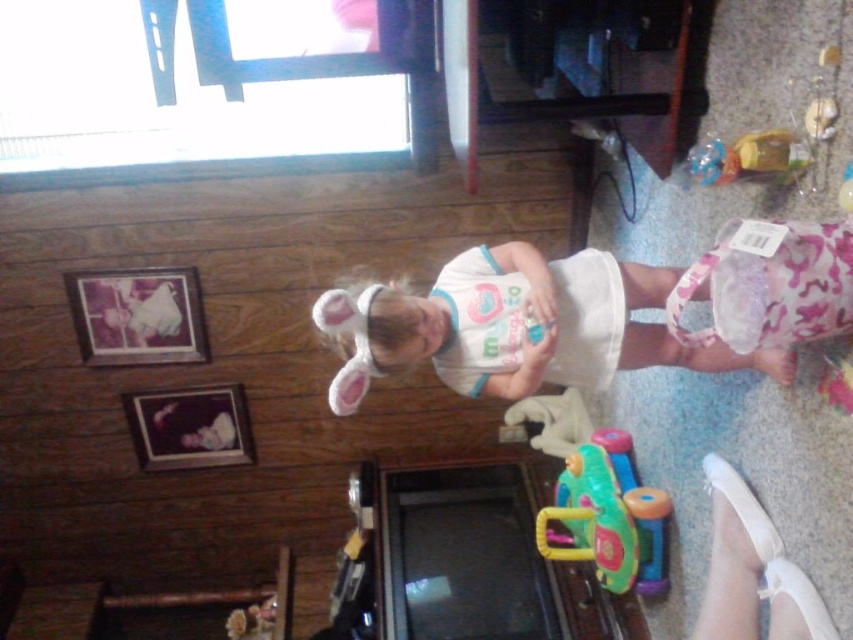
Based on the photo, you are a delivery robot in a living room. You need to place a small package at point [496,291]. Your arm can reach up to 1.8 meters. Can you reach that point?

The distance of point [496,291] from camera is 1.75 meters, so yes, the robot can reach that point since it is within the arm reach limit of 1.8 meters.

You are a photographer taking a picture of the white fabric dress at center and the rubberized plastic toy car at lower center. Which object is covering the other one in the image?

The white fabric dress at center is positioned over the rubberized plastic toy car at lower center, so the dress is covering the toy car.

The child is holding a small object in their hands. The white fabric dress at center is 5.19 feet away from the child. Is the dress within arm reach of the child?

The white fabric dress at center is 5.19 feet away from the child, which is beyond typical arm reach. The child cannot reach the dress with their arms.